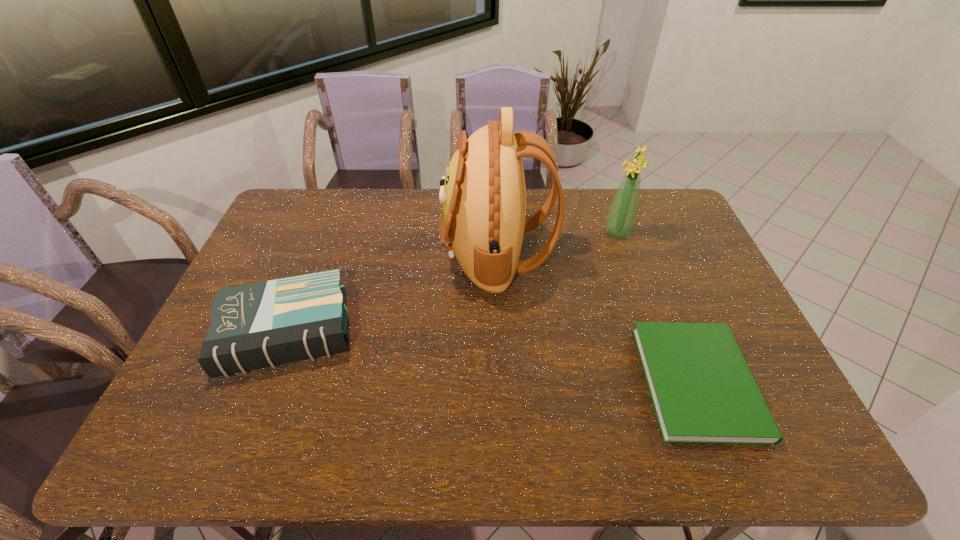
Find the location of a particular element. This screenshot has height=540, width=960. backpack is located at coordinates (483, 196).

At what (x,y) coordinates should I click in order to perform the action: click on the tallest object. Please return your answer as a coordinate pair (x, y). This screenshot has width=960, height=540. Looking at the image, I should click on (483, 196).

The width and height of the screenshot is (960, 540). In order to click on bouquet in this screenshot , I will do `click(621, 217)`.

The height and width of the screenshot is (540, 960). In order to click on the left paperback book in this screenshot , I will do `click(265, 324)`.

Locate an element on the screen. The width and height of the screenshot is (960, 540). the third tallest object is located at coordinates (265, 324).

Where is `the shorter paperback book`? the shorter paperback book is located at coordinates (703, 392).

Find the location of a particular element. the right paperback book is located at coordinates [703, 392].

Image resolution: width=960 pixels, height=540 pixels. I want to click on free spot located 0.400m on the front-facing side of the backpack, so click(319, 253).

You are a GUI agent. You are given a task and a screenshot of the screen. Output one action in this format:
    pyautogui.click(x=<x>, y=<y>)
    Task: Click on the vacant space located on the front-facing side of the backpack
    
    Given the screenshot: What is the action you would take?
    pyautogui.click(x=418, y=253)

I want to click on vacant space located 0.280m on the front-facing side of the backpack, so [x=356, y=253].